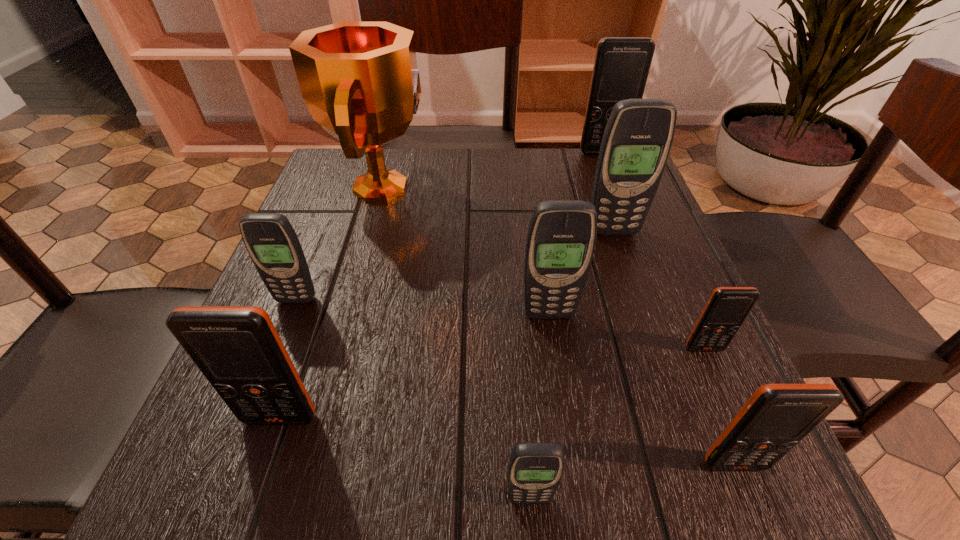
Where is `vacant region located 0.080m on the screen of the second biggest orange cellular telephone`? vacant region located 0.080m on the screen of the second biggest orange cellular telephone is located at coordinates (256, 489).

At what (x,y) coordinates should I click in order to perform the action: click on vacant space located on the screen of the third farthest gray cellular telephone. Please return your answer as a coordinate pair (x, y). Image resolution: width=960 pixels, height=540 pixels. Looking at the image, I should click on (558, 377).

You are a GUI agent. You are given a task and a screenshot of the screen. Output one action in this format:
    pyautogui.click(x=<x>, y=<y>)
    Task: Click on the vacant position located 0.320m on the screen of the third biggest gray cellular telephone
    The image size is (960, 540).
    Given the screenshot: What is the action you would take?
    pyautogui.click(x=216, y=503)

Where is `free space located 0.190m on the screen of the fourth nearest object`? free space located 0.190m on the screen of the fourth nearest object is located at coordinates (761, 479).

Locate an element on the screen. The width and height of the screenshot is (960, 540). award situated at the far edge is located at coordinates (359, 80).

At what (x,y) coordinates should I click in order to perform the action: click on cellular telephone that is at the far edge. Please return your answer as a coordinate pair (x, y). Image resolution: width=960 pixels, height=540 pixels. Looking at the image, I should click on (621, 67).

Identify the location of award positioned at the left edge. (359, 80).

The image size is (960, 540). I want to click on object that is at the far left corner, so click(359, 80).

I want to click on object that is at the far right corner, so click(621, 67).

The width and height of the screenshot is (960, 540). In order to click on object that is positioned at the near right corner in this screenshot , I will do `click(777, 417)`.